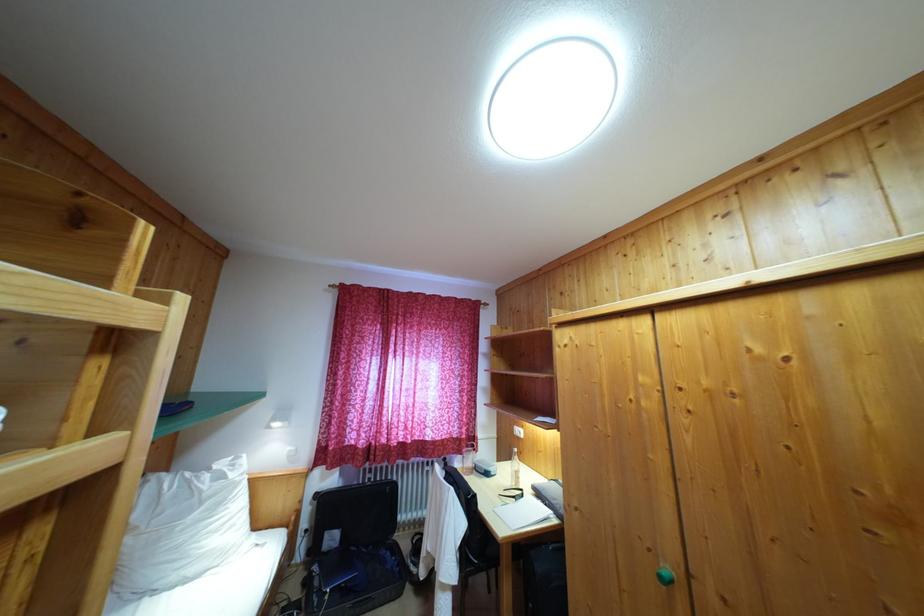
Find the location of a particular element. glass water bottle is located at coordinates (515, 469).